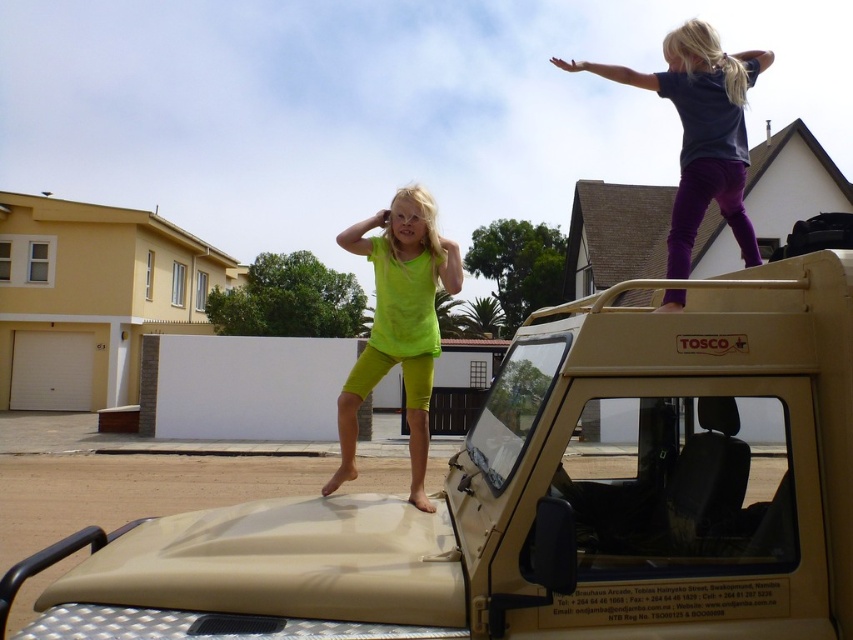
You are a parent trying to locate your child who is on the roof of the tan matte vehicle at center and near the dark blue fabric at upper right. Which object is closer to you, the parent, so you can reach your child faster?

The tan matte vehicle at center is closer to you than the dark blue fabric at upper right, so you should head towards the tan matte vehicle at center first.

You are a drone operator trying to deliver a package to the roof of the tan matte vehicle at center. The package must be dropped at the exact coordinates of point (547, 499). Can you confirm if this point is on the roof of the tan matte vehicle at center?

Yes, the point (547, 499) is on the roof of the tan matte vehicle at center, so the package can be safely dropped there.